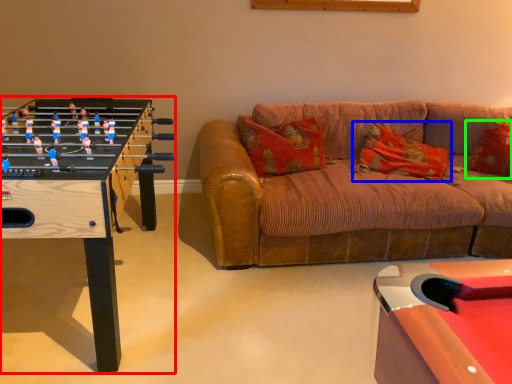
Question: Which object is positioned farthest from table (highlighted by a red box)? Select from pillow (highlighted by a blue box) and pillow (highlighted by a green box).

Choices:
 (A) pillow
 (B) pillow

Answer: (B)